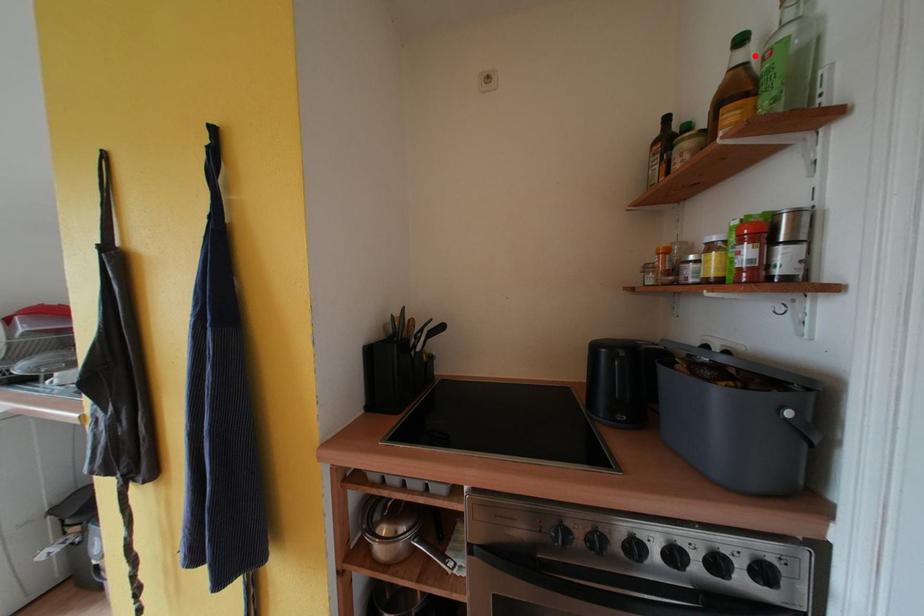
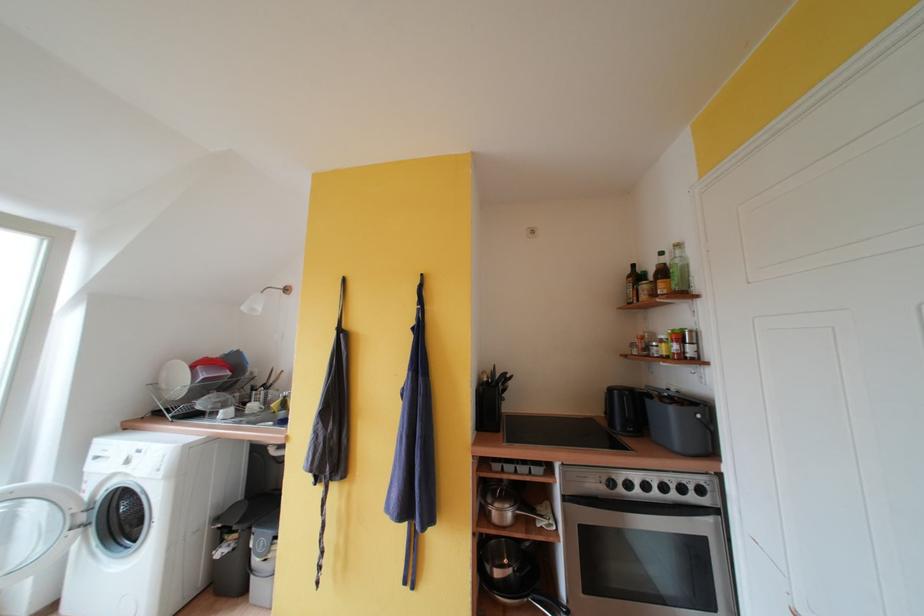
Find the pixel in the second image that matches the highlighted location in the first image.

(671, 262)